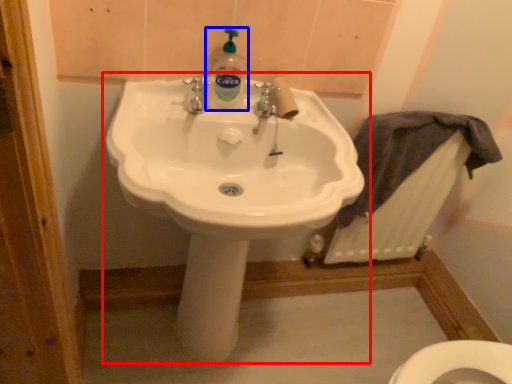
Question: Among these objects, which one is nearest to the camera, sink (highlighted by a red box) or cleaning product (highlighted by a blue box)?

Choices:
 (A) sink
 (B) cleaning product

Answer: (A)